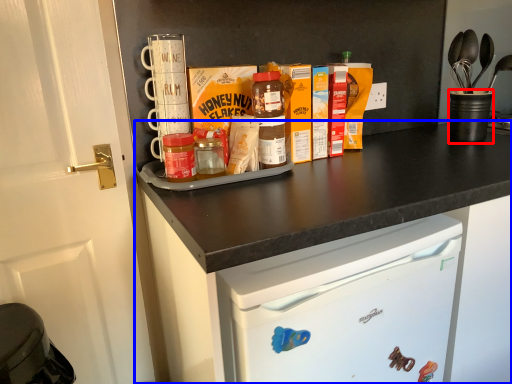
Question: Which object is closer to the camera taking this photo, appliance (highlighted by a red box) or cabinetry (highlighted by a blue box)?

Choices:
 (A) appliance
 (B) cabinetry

Answer: (B)